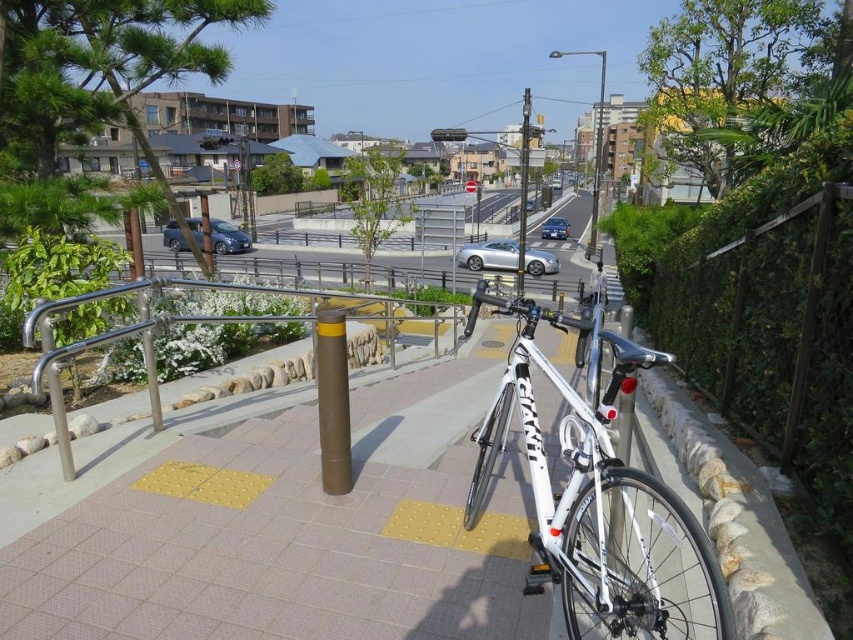
Does white matte bicycle at center come in front of silver metallic car at center?

Yes, it is.

From the picture: Can you confirm if white matte bicycle at center is positioned below silver metallic car at center?

Correct, white matte bicycle at center is located below silver metallic car at center.

Locate an element on the screen. This screenshot has width=853, height=640. white matte bicycle at center is located at coordinates (x=593, y=493).

Between silver metallic sedan at left and metallic pole at center, which one is positioned higher?

metallic pole at center is higher up.

Consider the image. Between silver metallic sedan at left and metallic pole at center, which one has more height?

Standing taller between the two is metallic pole at center.

Find the location of a particular element. silver metallic sedan at left is located at coordinates (227, 237).

Can you confirm if white matte bicycle at center is shorter than metallic gray pole at center?

Correct, white matte bicycle at center is not as tall as metallic gray pole at center.

How distant is white matte bicycle at center from metallic gray pole at center?

white matte bicycle at center is 107.93 feet from metallic gray pole at center.

Does point (566, 452) come farther from viewer compared to point (593, 186)?

No, it is not.

Where is `white matte bicycle at center`? white matte bicycle at center is located at coordinates (593, 493).